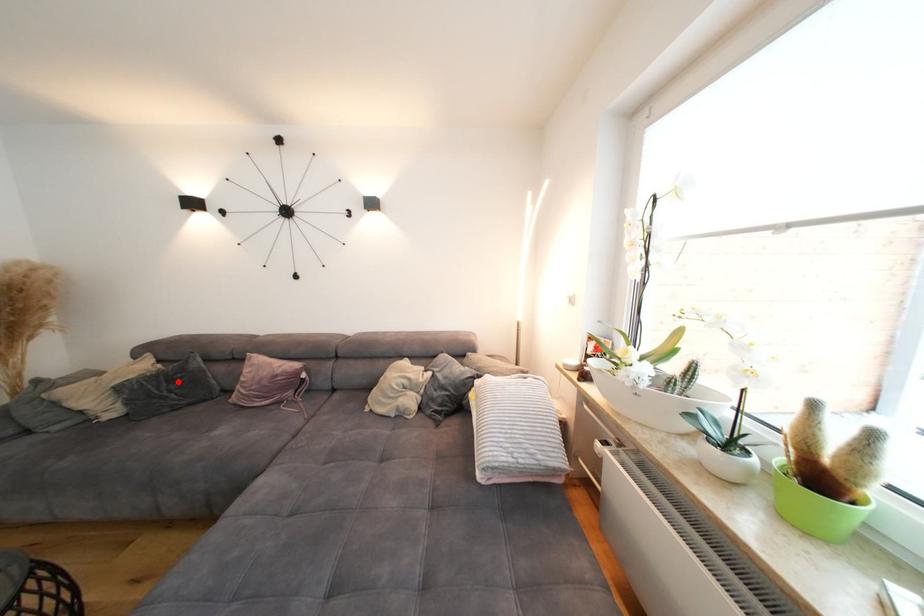
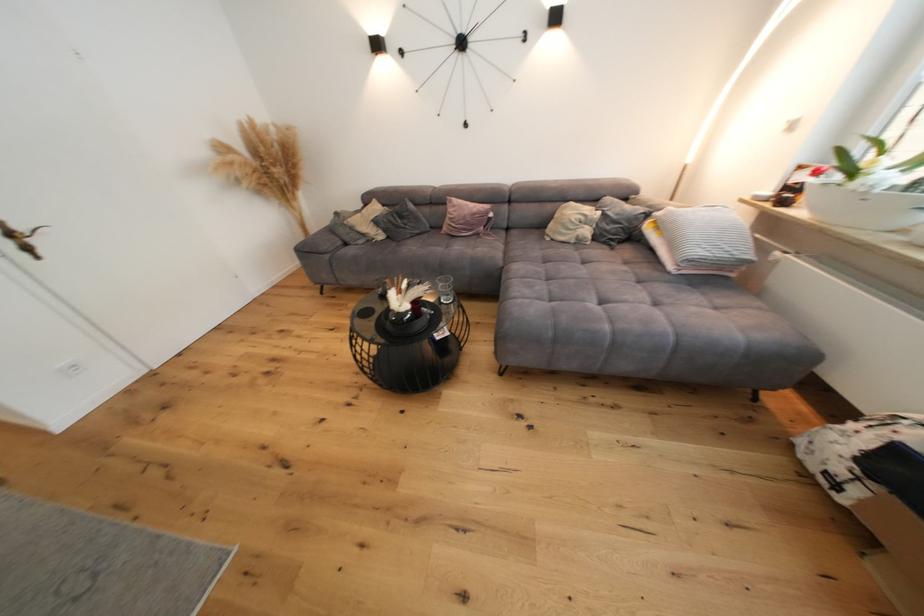
Locate, in the second image, the point that corresponds to the highlighted location in the first image.

(408, 219)